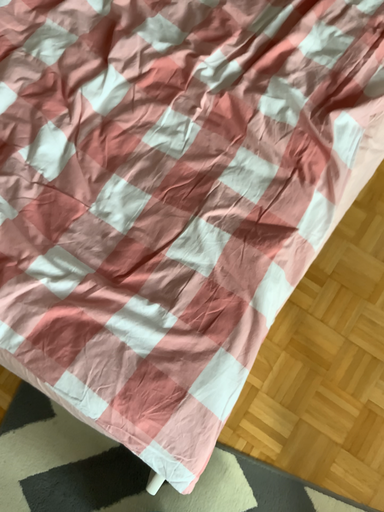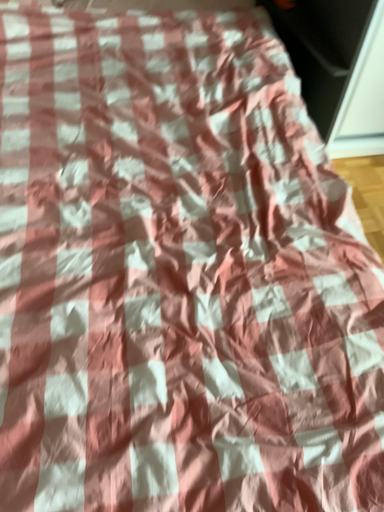
Question: How did the camera likely rotate when shooting the video?

Choices:
 (A) rotated left
 (B) rotated right

Answer: (B)